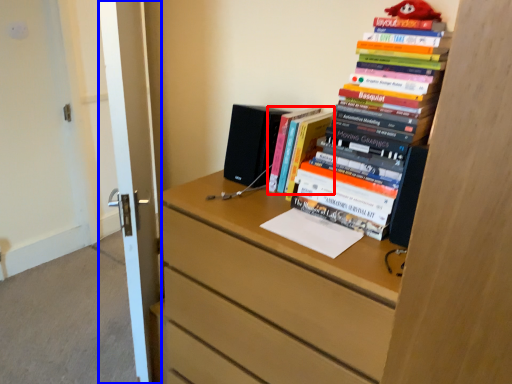
Question: Which of the following is the closest to the observer, book (highlighted by a red box) or door (highlighted by a blue box)?

Choices:
 (A) book
 (B) door

Answer: (B)